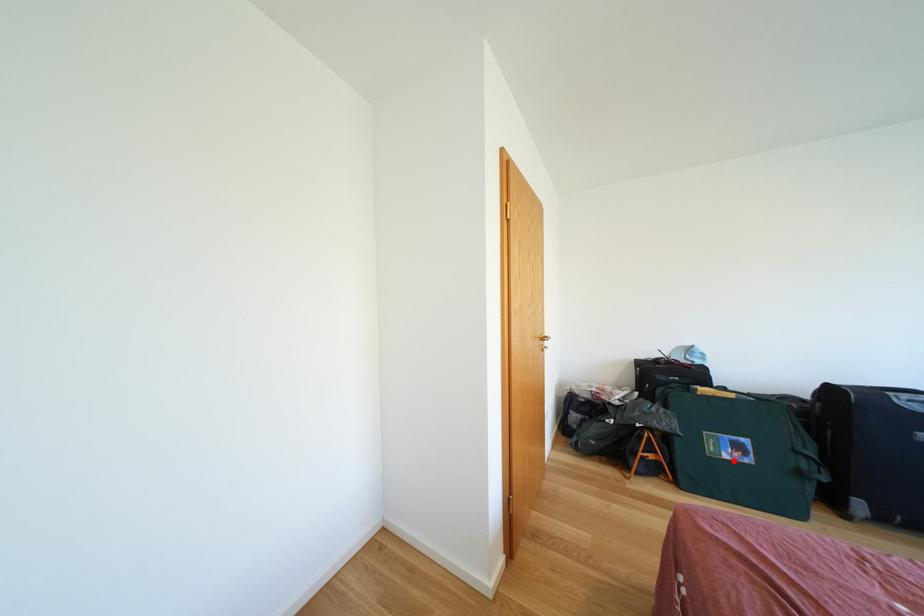
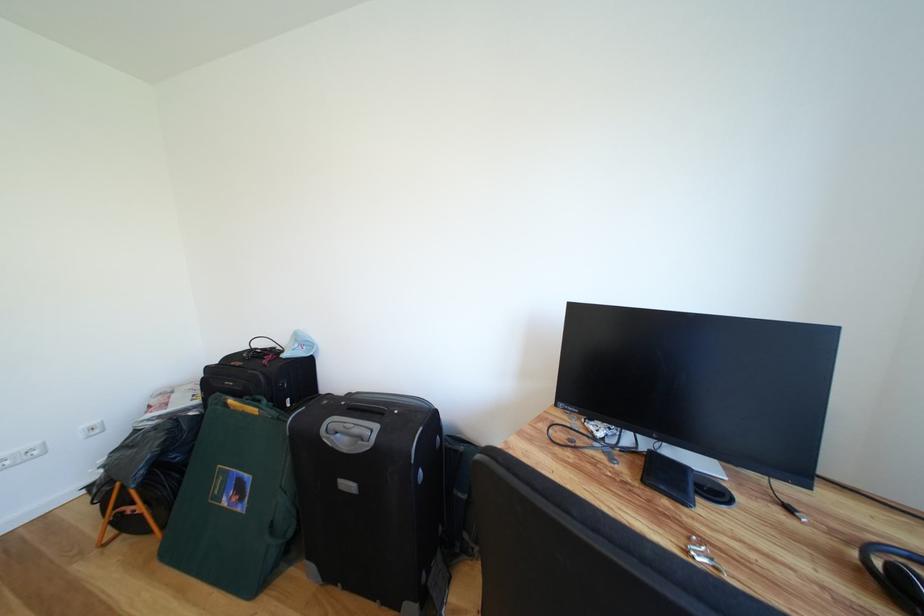
Where in the second image is the point corresponding to the highlighted location from the first image?

(234, 506)